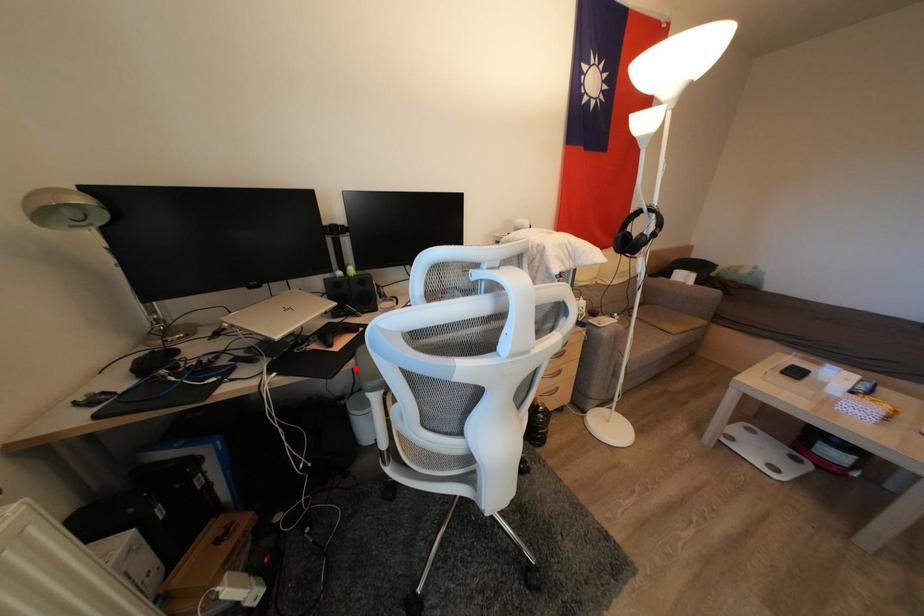
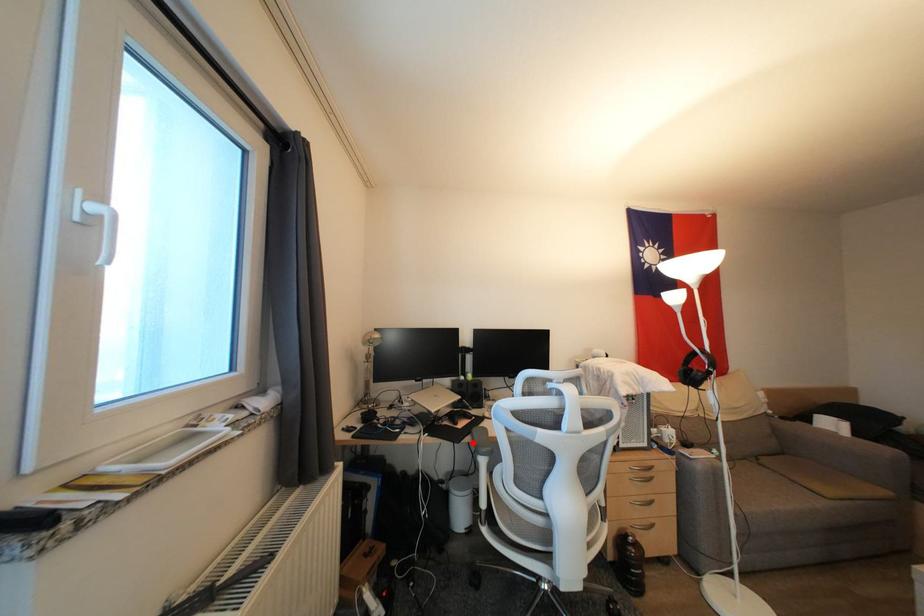
I am providing you with two images of the same scene from different viewpoints. A red point is marked on the first image and another point is marked on the second image. Is the red point in image1 aligned with the point shown in image2?

Yes